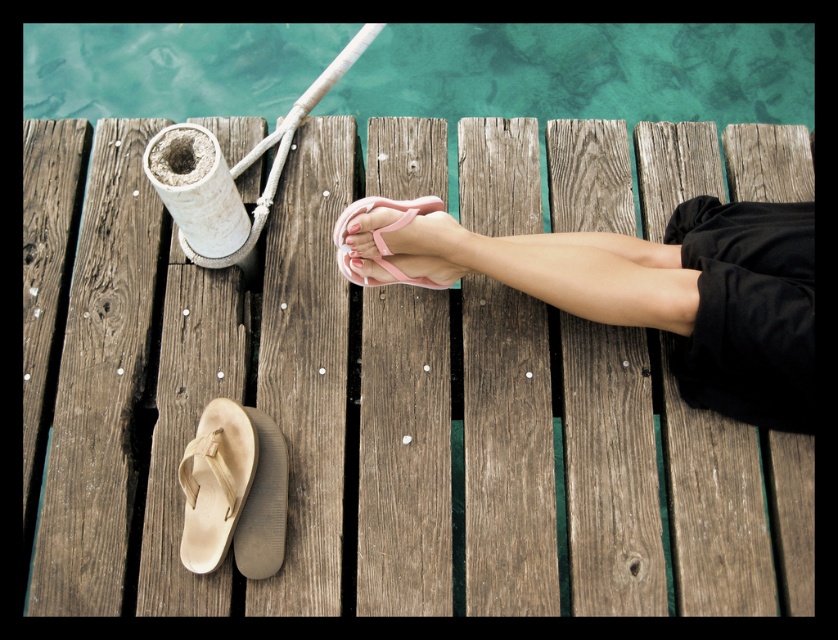
What do you see at coordinates (234, 490) in the screenshot?
I see `tan leather sandal at lower left` at bounding box center [234, 490].

Who is more distant from viewer, (234, 490) or (347, 253)?

Point (347, 253)

This screenshot has height=640, width=838. I want to click on tan leather sandal at lower left, so click(x=234, y=490).

Can you confirm if wooden dock at center is thinner than tan leather sandal at lower left?

No.

Does wooden dock at center have a lesser height compared to tan leather sandal at lower left?

No.

From the picture: Who is more forward, (164, 349) or (282, 490)?

Point (282, 490)

Identify the location of wooden dock at center. This screenshot has height=640, width=838. (370, 424).

Does wooden dock at center have a greater height compared to clear blue water at upper center?

Yes.

Who is more distant from viewer, (671, 492) or (119, 38)?

The point (119, 38) is behind.

Is point (675, 483) in front of point (568, 113)?

Yes, it is in front of point (568, 113).

I want to click on wooden dock at center, so click(x=370, y=424).